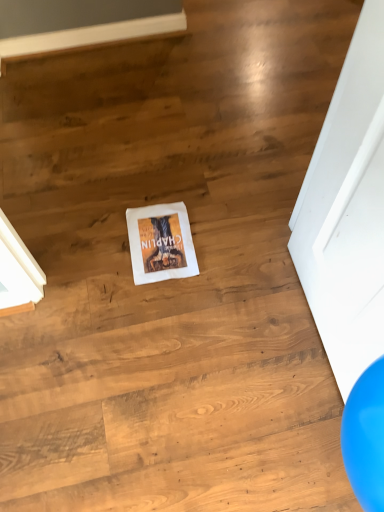
Question: From their relative heights in the image, would you say white matte door at center is taller or shorter than white cloth at center?

Choices:
 (A) short
 (B) tall

Answer: (B)

Question: From a real-world perspective, is white matte door at center above or below white cloth at center?

Choices:
 (A) above
 (B) below

Answer: (A)

Question: Would you say white matte door at center is inside or outside white cloth at center?

Choices:
 (A) outside
 (B) inside

Answer: (A)

Question: Relative to white matte door at center, is white cloth at center in front or behind?

Choices:
 (A) front
 (B) behind

Answer: (B)

Question: Choose the correct answer: Is white cloth at center inside white matte door at center or outside it?

Choices:
 (A) outside
 (B) inside

Answer: (A)

Question: Considering the positions of white cloth at center and white matte door at center in the image, is white cloth at center taller or shorter than white matte door at center?

Choices:
 (A) short
 (B) tall

Answer: (A)

Question: Based on their sizes in the image, would you say white cloth at center is bigger or smaller than white matte door at center?

Choices:
 (A) small
 (B) big

Answer: (A)